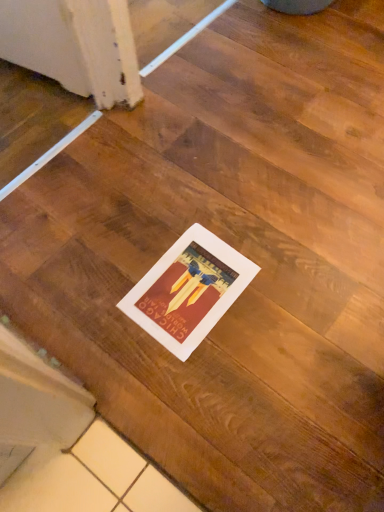
The image size is (384, 512). I want to click on free point behind matte paper poster at center, so click(x=183, y=209).